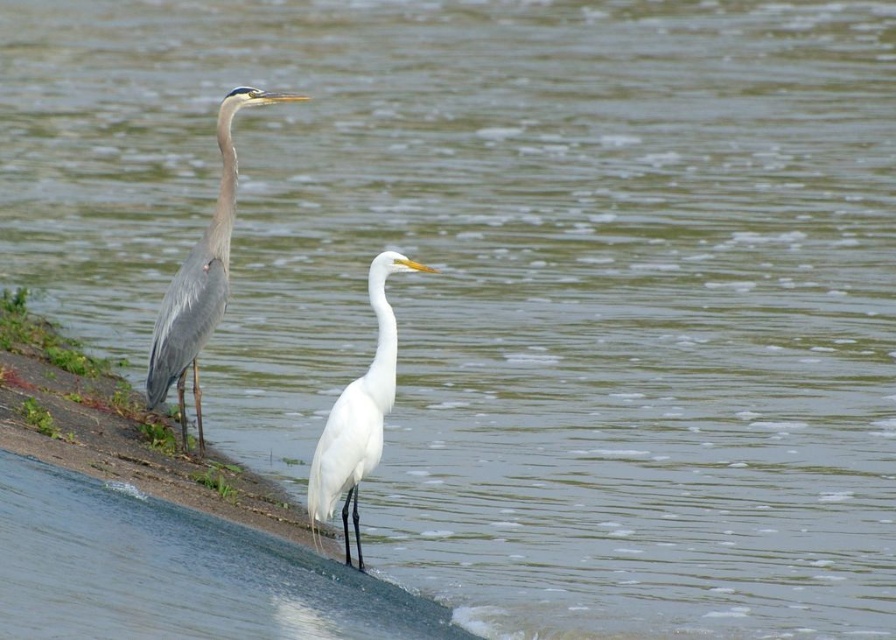
You are a photographer trying to capture both herons in a single shot. Given that the gray matte heron at left is located at point (x=200, y=280), can you determine if the white heron at right is positioned to the left or right of this point?

The white heron at right is positioned to the right of the point (x=200, y=280) since the gray matte heron at left is at that location and the white heron is described as being on the right side.

You are a birdwatcher observing the gray matte heron at left and the white smooth heron at center. Which heron is taller?

The gray matte heron at left is taller than the white smooth heron at center.

You are taking a photo of the two herons in the scene. You want to focus on the heron that is closer to the camera. Which point should you focus on, point (197, 353) or point (350, 483)?

Point (197, 353) is further to the camera than point (350, 483), so you should focus on point (197, 353) to capture the heron closer to the camera.